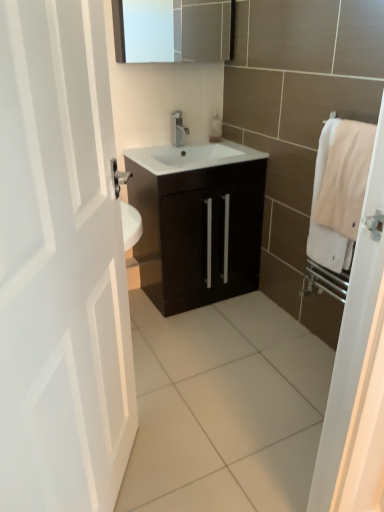
This screenshot has width=384, height=512. What are the coordinates of `empty space that is in between satin nickel faucet at center and translucent plastic soap dispenser at center` in the screenshot? It's located at (197, 143).